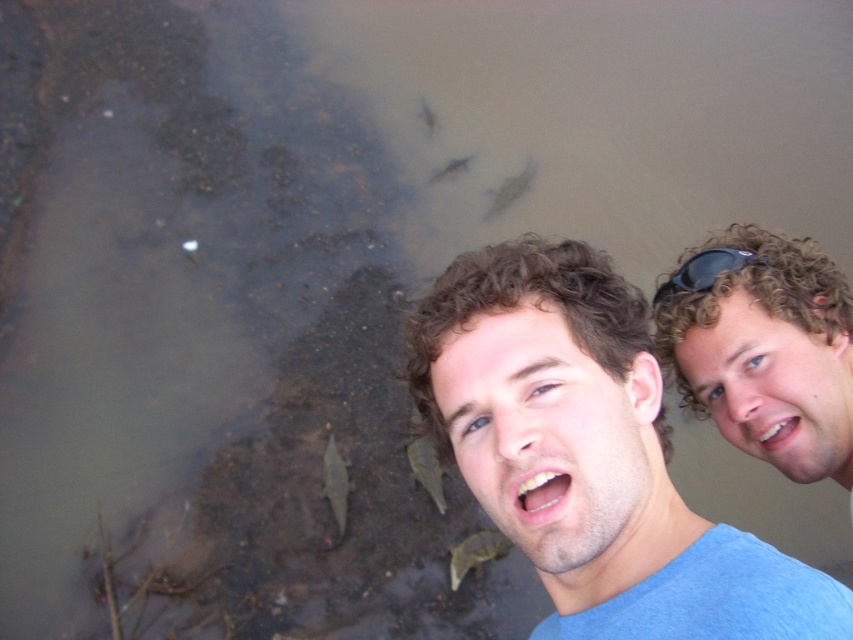
Question: Can you confirm if blue matte shirt at lower right is positioned to the right of green matte fish at lower center?

Choices:
 (A) no
 (B) yes

Answer: (B)

Question: Is blue matte shirt at lower right bigger than shiny silver fish at center?

Choices:
 (A) yes
 (B) no

Answer: (A)

Question: Based on their relative distances, which object is nearer to the blue matte shirt at lower right?

Choices:
 (A) shiny silver fish at center
 (B) curly hair at center

Answer: (B)

Question: Among these objects, which one is farthest from the camera?

Choices:
 (A) shiny silver fish at center
 (B) translucent grayish fish at center
 (C) blue matte shirt at lower right

Answer: (B)

Question: Which object appears farthest from the camera in this image?

Choices:
 (A) curly hair at center
 (B) translucent grayish fish at center
 (C) green matte fish at lower center

Answer: (B)

Question: Can you confirm if blue matte shirt at lower right is wider than shiny silver fish at center?

Choices:
 (A) yes
 (B) no

Answer: (A)